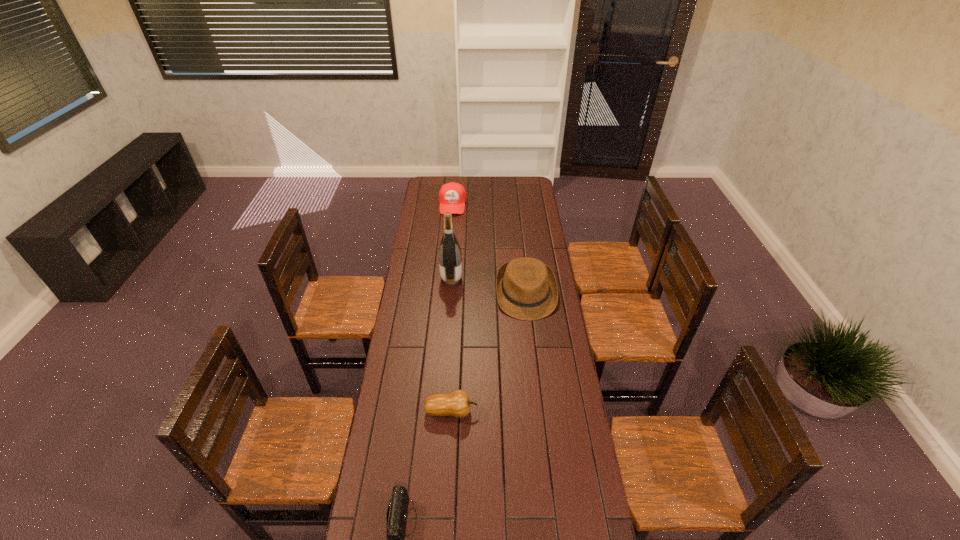
What are the coordinates of `object that is positioned at the right edge` in the screenshot? It's located at [x=526, y=288].

You are a GUI agent. You are given a task and a screenshot of the screen. Output one action in this format:
    pyautogui.click(x=<x>, y=<y>)
    Task: Click on the object present at the far left corner
    The image size is (960, 540).
    Given the screenshot: What is the action you would take?
    pyautogui.click(x=452, y=196)

Locate an element on the screen. The width and height of the screenshot is (960, 540). vacant region at the left edge of the desktop is located at coordinates (416, 336).

Find the location of a particular element. This screenshot has height=540, width=960. blank area at the right edge is located at coordinates (588, 536).

Identify the location of vacant area at the far left corner of the desktop. (435, 177).

Locate an element on the screen. The image size is (960, 540). vacant area at the far right corner is located at coordinates (523, 185).

Where is `vacant point located between the wine bottle and the rightmost object`? The height and width of the screenshot is (540, 960). vacant point located between the wine bottle and the rightmost object is located at coordinates (489, 286).

Find the location of a particular element. This screenshot has height=540, width=960. free spot between the farthest object and the fourth farthest object is located at coordinates (452, 308).

Identify the location of vacant area that lies between the tallest object and the gourd. pyautogui.click(x=451, y=345).

At what (x,y) coordinates should I click in order to perform the action: click on object that can be found as the fourth closest to the rightmost object. Please return your answer as a coordinate pair (x, y). The height and width of the screenshot is (540, 960). Looking at the image, I should click on (396, 517).